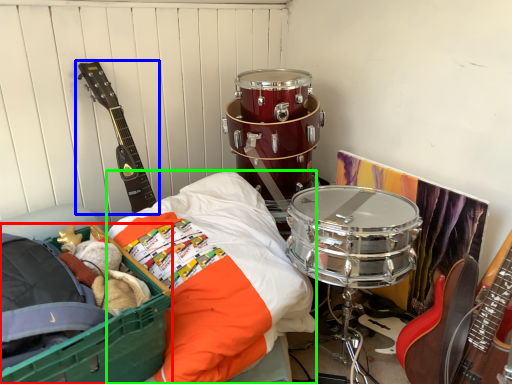
Question: Which object is positioned closest to storage box (highlighted by a red box)? Select from guitar (highlighted by a blue box) and sheet (highlighted by a green box).

Choices:
 (A) guitar
 (B) sheet

Answer: (B)